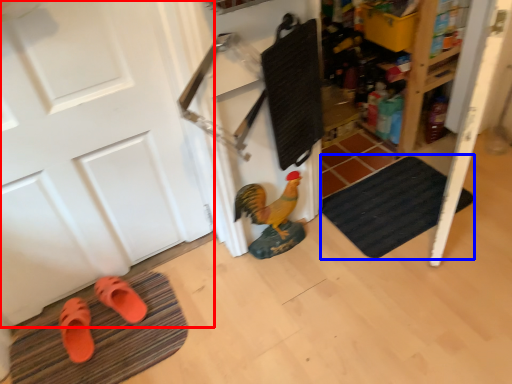
Question: Among these objects, which one is farthest to the camera, door (highlighted by a red box) or bath mat (highlighted by a blue box)?

Choices:
 (A) door
 (B) bath mat

Answer: (B)